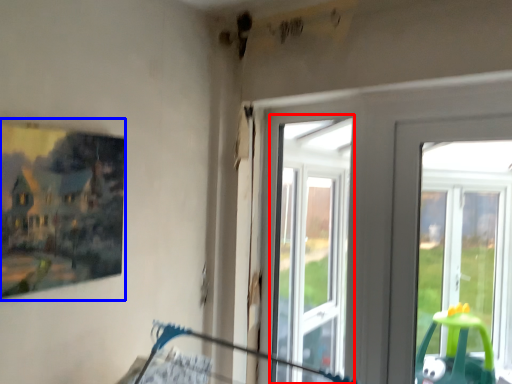
Question: Among these objects, which one is nearest to the camera, bay window (highlighted by a red box) or picture frame (highlighted by a blue box)?

Choices:
 (A) bay window
 (B) picture frame

Answer: (B)